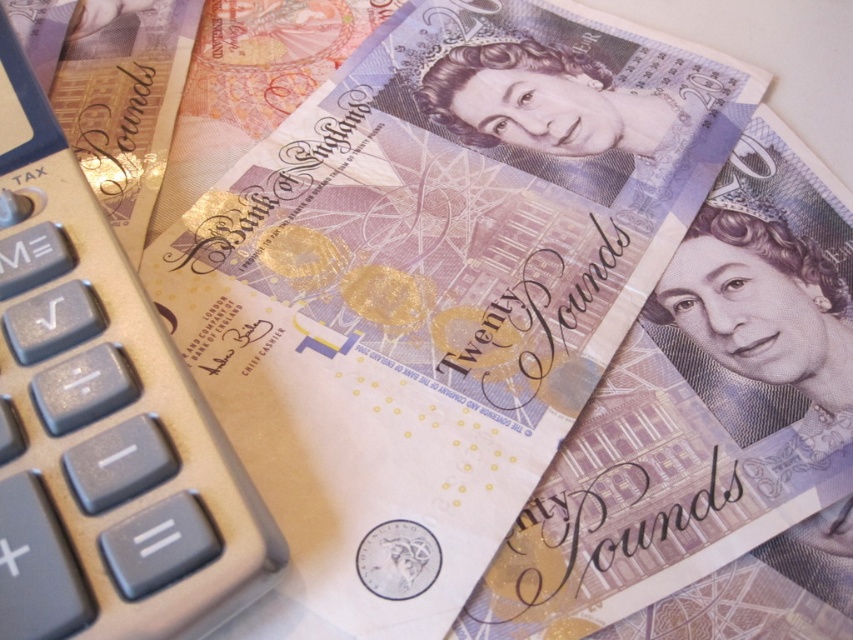
Who is lower down, matte purple banknote at center or silver metallic calculator at left?

silver metallic calculator at left is lower down.

Who is more distant from viewer, (680, 166) or (32, 310)?

Point (680, 166)

Is point (372, 51) closer to viewer compared to point (10, 147)?

No.

Locate an element on the screen. The width and height of the screenshot is (853, 640). matte purple banknote at center is located at coordinates (438, 282).